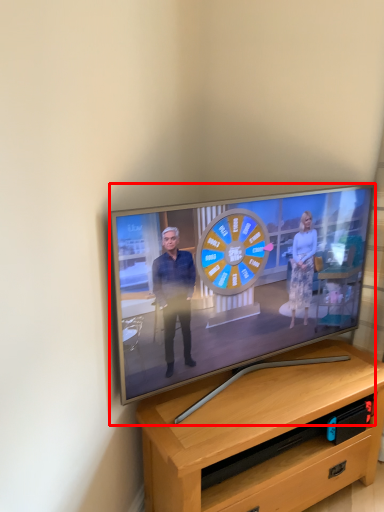
Question: From the image's perspective, considering the relative positions of television (annotated by the red box) and desk in the image provided, where is television (annotated by the red box) located with respect to the staircase?

Choices:
 (A) above
 (B) below

Answer: (A)